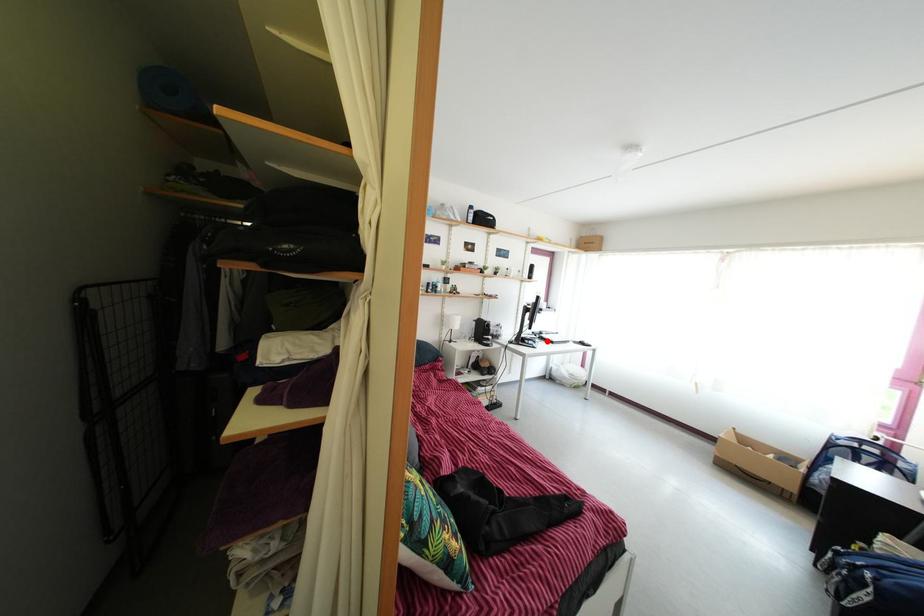
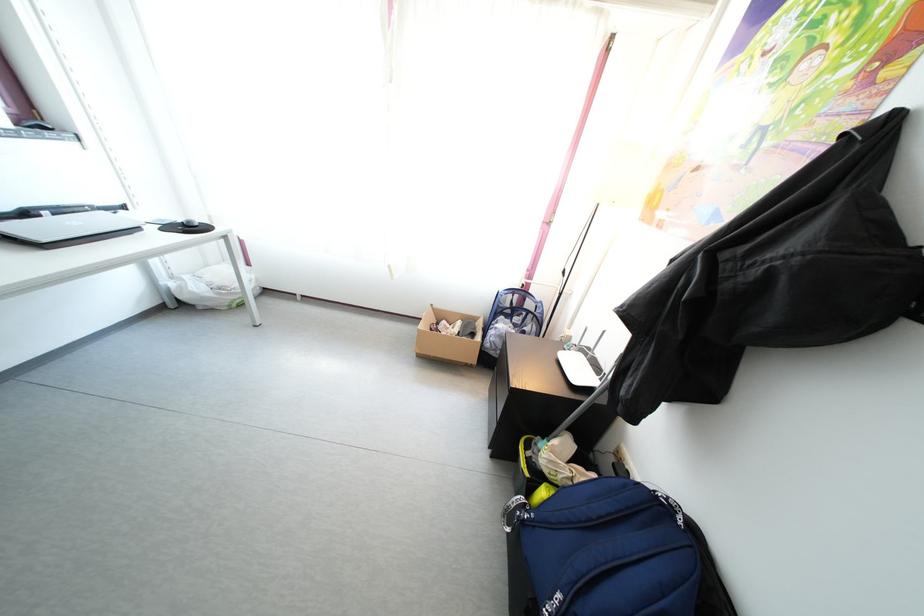
Question: I am providing you with two images of the same scene from different viewpoints. In image1, a red point is highlighted. Considering the same 3D point in image2, which of the following is correct?

Choices:
 (A) It is closer
 (B) It is farther

Answer: (B)